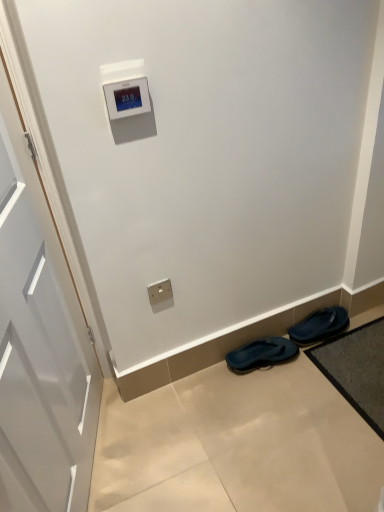
Image resolution: width=384 pixels, height=512 pixels. I want to click on vacant space to the right of black rubber slippers at lower right, placed as the 2th footwear when sorted from left to right, so tap(360, 334).